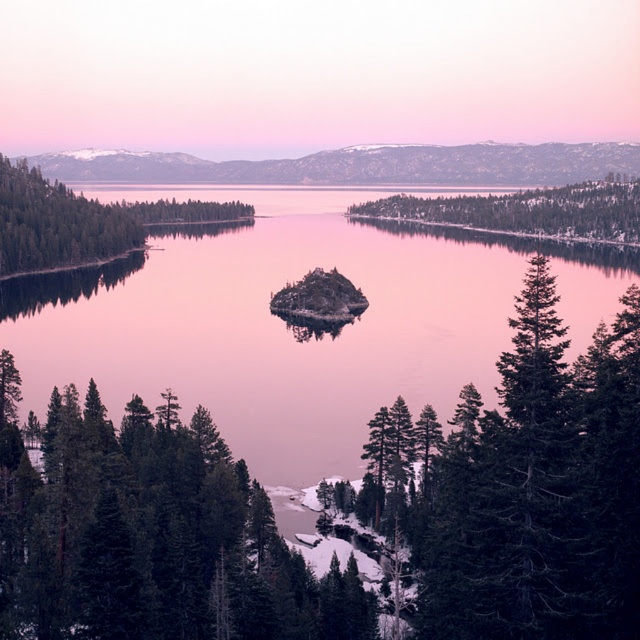
Question: Is green matte island at center thinner than green matte tree at left?

Choices:
 (A) yes
 (B) no

Answer: (B)

Question: Considering the relative positions of green matte island at center and green matte tree at left in the image provided, where is green matte island at center located with respect to green matte tree at left?

Choices:
 (A) below
 (B) above

Answer: (B)

Question: Observing the image, what is the correct spatial positioning of clear water at center in reference to green matte tree at left?

Choices:
 (A) above
 (B) below

Answer: (B)

Question: Which object is positioned farthest from the green matte island at center?

Choices:
 (A) green matte tree at left
 (B) clear water at center

Answer: (A)

Question: Which is nearer to the clear water at center?

Choices:
 (A) green matte island at center
 (B) green matte tree at left

Answer: (B)

Question: Which object is closer to the camera taking this photo?

Choices:
 (A) clear water at center
 (B) green matte island at center

Answer: (A)